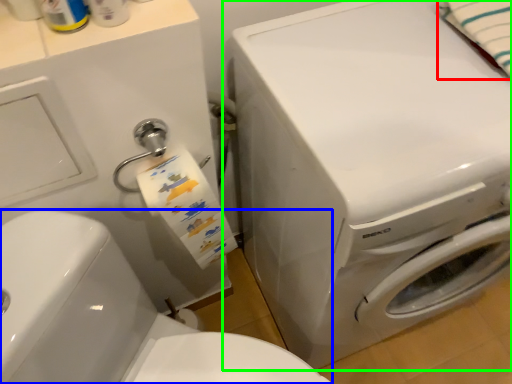
Question: Estimate the real-world distances between objects in this image. Which object is farther from bath towel (highlighted by a red box), washer (highlighted by a blue box) or washing machine (highlighted by a green box)?

Choices:
 (A) washer
 (B) washing machine

Answer: (A)